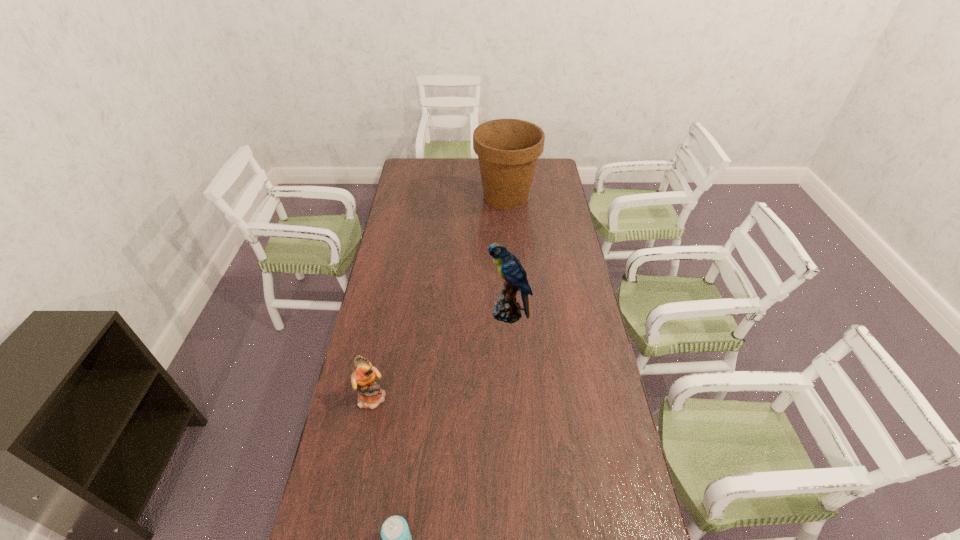
The height and width of the screenshot is (540, 960). In order to click on vacant space that is in between the leftmost object and the right parrot in this screenshot , I will do `click(441, 355)`.

The width and height of the screenshot is (960, 540). I want to click on free space between the second nearest object and the taller parrot, so click(x=441, y=355).

Identify which object is the third closest to the flowerpot. Please provide its 2D coordinates. Your answer should be formatted as a tuple, i.e. [(x, y)], where the tuple contains the x and y coordinates of a point satisfying the conditions above.

[(396, 539)]

Find the location of a particular element. The image size is (960, 540). object that is the third nearest to the shortest object is located at coordinates (508, 149).

The width and height of the screenshot is (960, 540). Find the location of `free space that satisfies the following two spatial constraints: 1. on the front side of the farthest object; 2. on the front-facing side of the left parrot`. free space that satisfies the following two spatial constraints: 1. on the front side of the farthest object; 2. on the front-facing side of the left parrot is located at coordinates (521, 397).